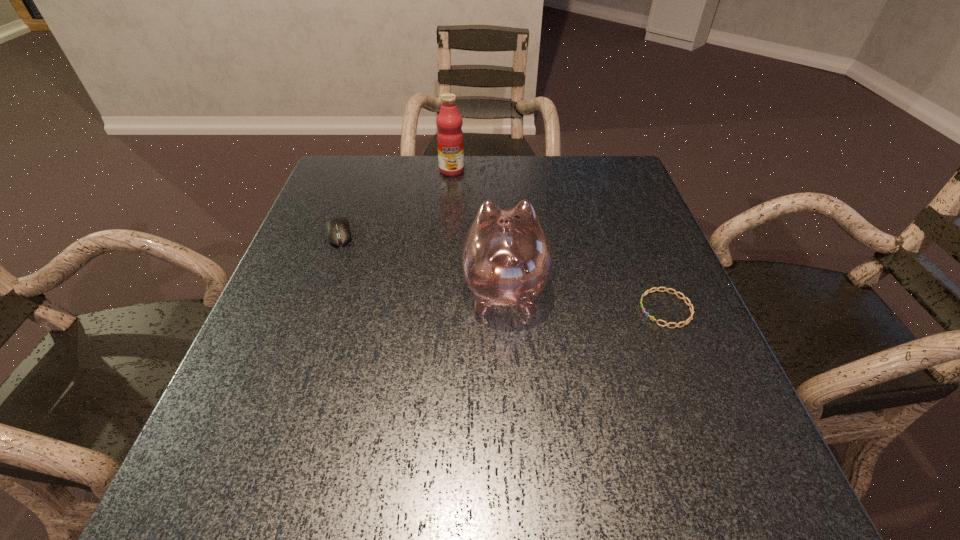
Image resolution: width=960 pixels, height=540 pixels. I want to click on fruit juice, so click(x=450, y=141).

The width and height of the screenshot is (960, 540). Find the location of `the third object from right to left`. the third object from right to left is located at coordinates (450, 141).

Locate an element on the screen. The image size is (960, 540). piggy bank is located at coordinates (506, 259).

Where is `the second tallest object`? Image resolution: width=960 pixels, height=540 pixels. the second tallest object is located at coordinates (506, 259).

Where is `the leftmost object`? the leftmost object is located at coordinates (338, 232).

Identify the location of the second farthest object. (338, 232).

At what (x,y) coordinates should I click in order to perform the action: click on the shortest object. Please return your answer as a coordinate pair (x, y). Image resolution: width=960 pixels, height=540 pixels. Looking at the image, I should click on (689, 304).

This screenshot has width=960, height=540. In order to click on the rightmost object in this screenshot , I will do `click(689, 304)`.

You are a GUI agent. You are given a task and a screenshot of the screen. Output one action in this format:
    pyautogui.click(x=<x>, y=<y>)
    Task: Click on the blank space located on the label of the fruit juice
    
    Given the screenshot: What is the action you would take?
    pyautogui.click(x=448, y=206)

At what (x,y) coordinates should I click in order to perform the action: click on blank space located 0.190m on the front facing side of the second tallest object. Please return your answer as a coordinate pair (x, y). Image resolution: width=960 pixels, height=540 pixels. Looking at the image, I should click on (500, 206).